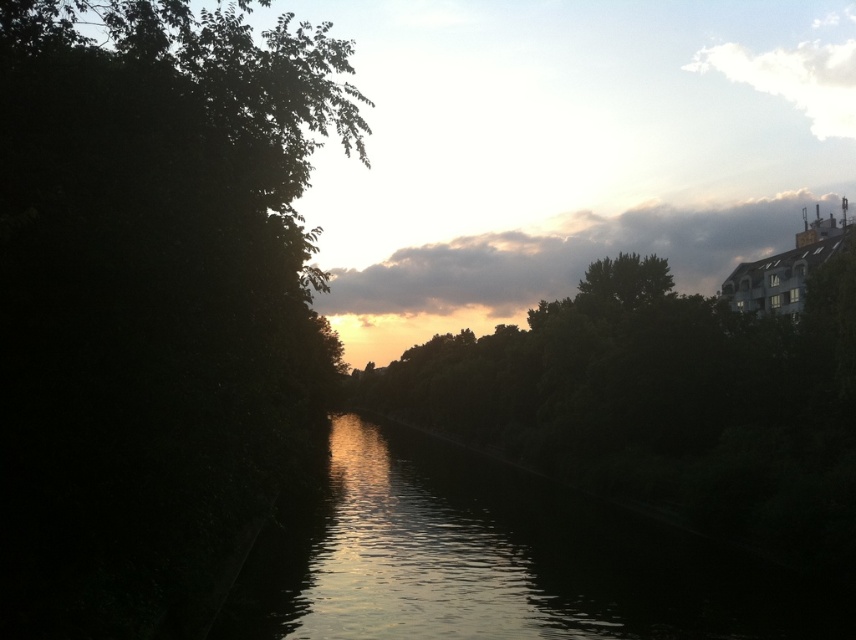
Question: Where is dark green leafy tree at left located in relation to silvery reflective water at center in the image?

Choices:
 (A) below
 (B) above

Answer: (B)

Question: Does dark green leafy tree at left come in front of silvery reflective water at center?

Choices:
 (A) yes
 (B) no

Answer: (A)

Question: Does dark green leafy tree at left appear on the right side of silvery reflective water at center?

Choices:
 (A) yes
 (B) no

Answer: (B)